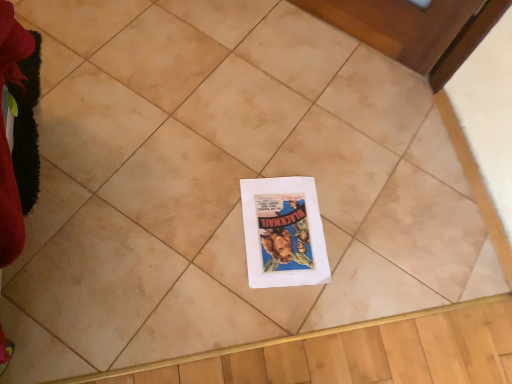
This screenshot has width=512, height=384. Identify the location of vacant space underneath white paper flyer at center (from a real-world perspective). tap(284, 231).